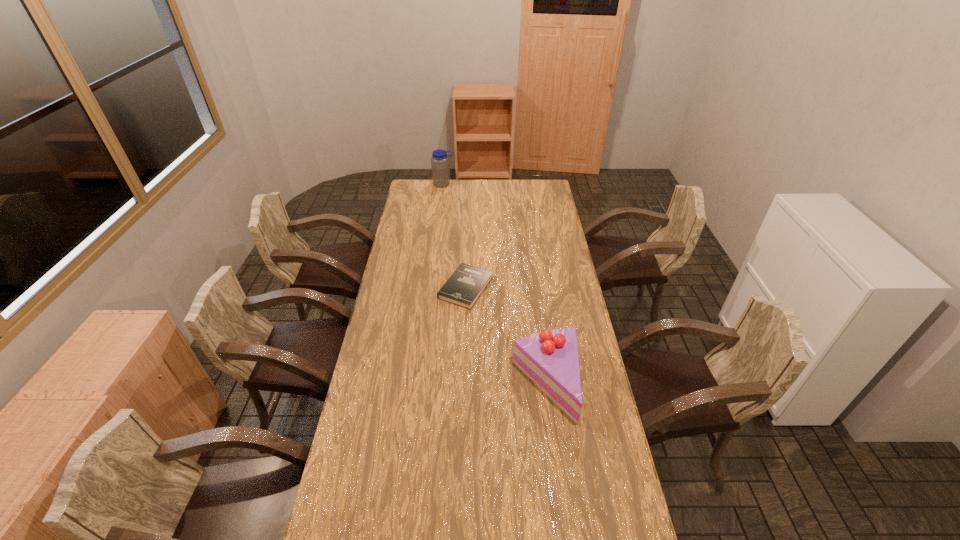
The width and height of the screenshot is (960, 540). Find the location of `object that is at the left edge`. object that is at the left edge is located at coordinates (440, 168).

The height and width of the screenshot is (540, 960). I want to click on object located at the right edge, so click(550, 358).

The width and height of the screenshot is (960, 540). I want to click on object at the far left corner, so click(440, 168).

You are a GUI agent. You are given a task and a screenshot of the screen. Output one action in this format:
    pyautogui.click(x=<x>, y=<y>)
    Task: Click on the free space at the far edge of the desktop
    The height and width of the screenshot is (540, 960).
    Given the screenshot: What is the action you would take?
    pyautogui.click(x=471, y=187)

In the image, there is a desktop. Where is `blank space at the left edge`? blank space at the left edge is located at coordinates (410, 243).

Where is `free space at the right edge of the desktop`? This screenshot has width=960, height=540. free space at the right edge of the desktop is located at coordinates (538, 209).

Locate an element on the screen. This screenshot has width=960, height=540. free location at the far left corner of the desktop is located at coordinates (423, 198).

You are a GUI agent. You are given a task and a screenshot of the screen. Output one action in this format:
    pyautogui.click(x=<x>, y=<y>)
    Task: Click on the blank area at the far right corner
    The image size is (960, 540).
    Given the screenshot: What is the action you would take?
    pyautogui.click(x=533, y=182)

The image size is (960, 540). What are the coordinates of `vacant area that lies between the second farthest object and the tallest object` in the screenshot? It's located at (455, 236).

You are a GUI agent. You are given a task and a screenshot of the screen. Output one action in this format:
    pyautogui.click(x=<x>, y=<y>)
    Task: Click on the empty location between the second nearest object and the cake
    The image size is (960, 540).
    Given the screenshot: What is the action you would take?
    pyautogui.click(x=506, y=335)